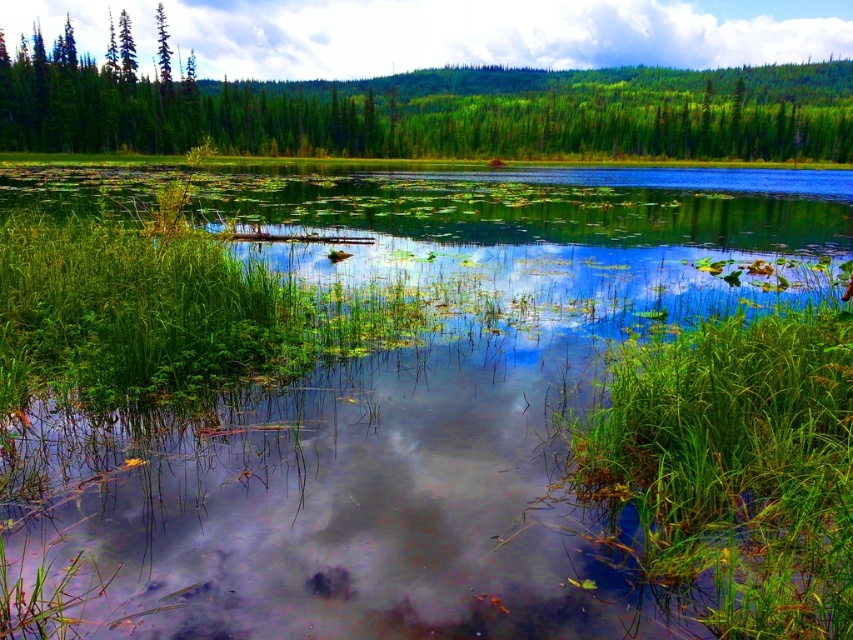
You are standing at the edge of the water in the scene and want to reach the point marked as point (425, 404). Based on the description, what will you find when you arrive there?

You will find transparent water at center at point (425, 404).

From the picture: You are standing on the lakeside and looking at the white fluffy cloud at upper center and the green matte tree at upper left. Which object appears nearer to you?

The white fluffy cloud at upper center appears nearer to you because it is closer to the viewer than the green matte tree at upper left.